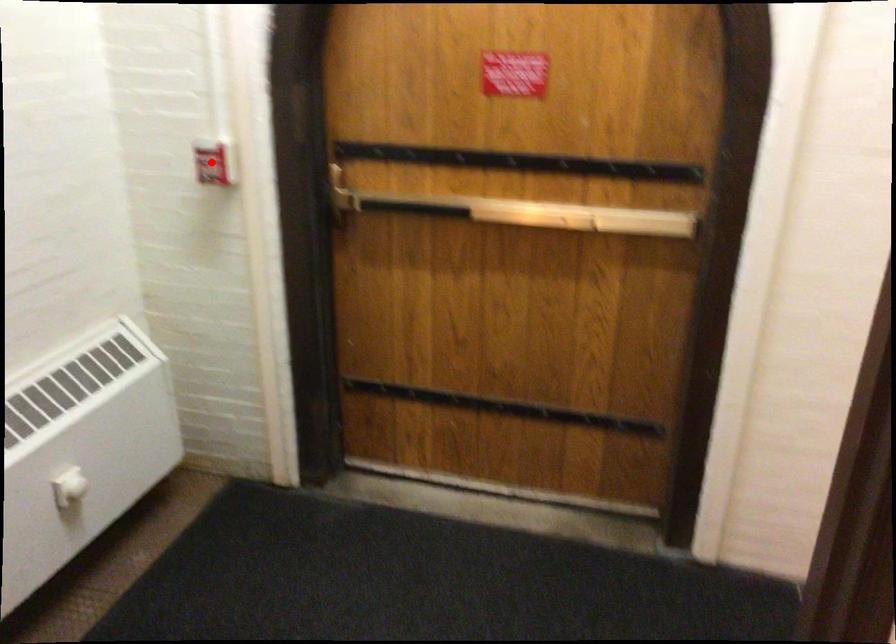
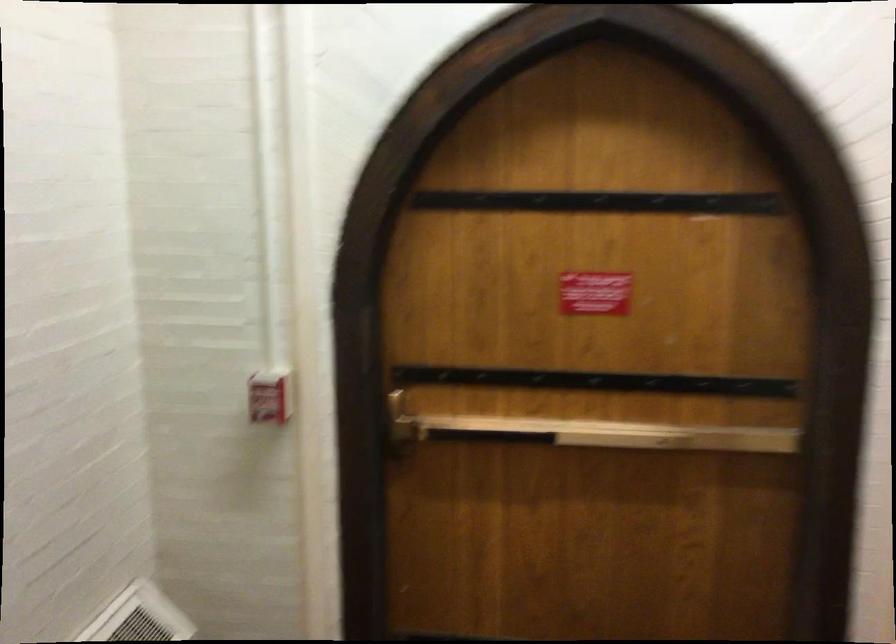
Locate, in the second image, the point that corresponds to the highlighted location in the first image.

(270, 395)